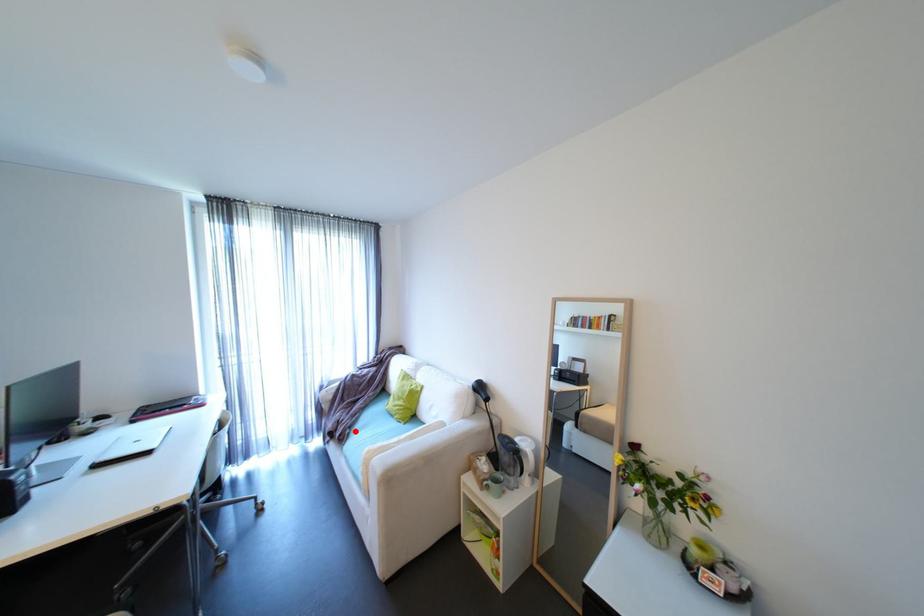
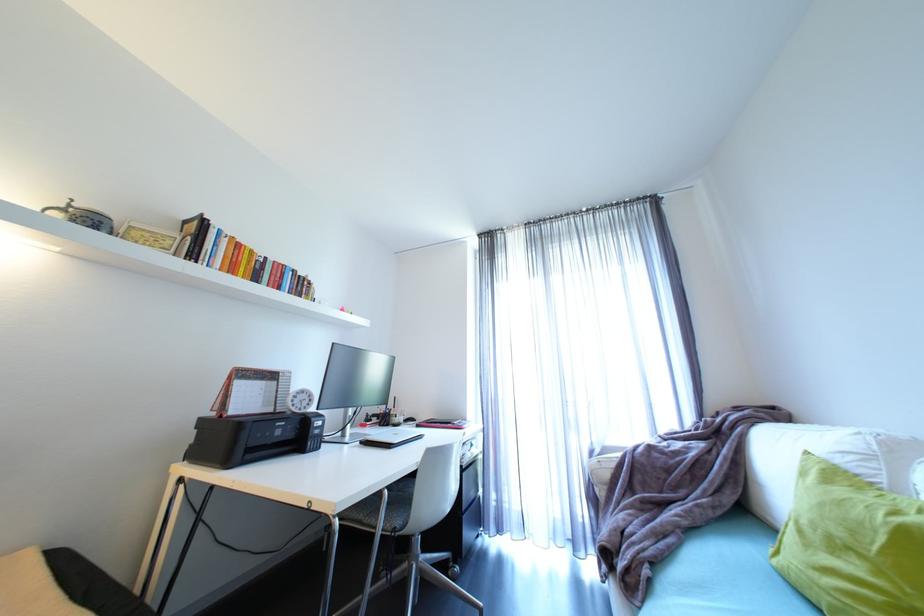
Question: I am providing you with two images of the same scene from different viewpoints. In image1, a red point is highlighted. Considering the same 3D point in image2, which of the following is correct?

Choices:
 (A) It is closer
 (B) It is farther

Answer: (A)